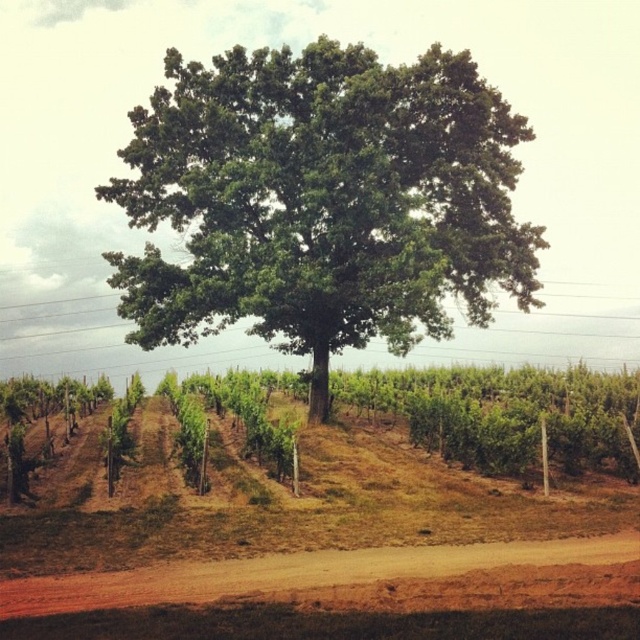
Between green leafy oak at center and brown dirt track at lower center, which one appears on the left side from the viewer's perspective?

From the viewer's perspective, green leafy oak at center appears more on the left side.

You are a GUI agent. You are given a task and a screenshot of the screen. Output one action in this format:
    pyautogui.click(x=<x>, y=<y>)
    Task: Click on the green leafy oak at center
    The height and width of the screenshot is (640, 640).
    Given the screenshot: What is the action you would take?
    pyautogui.click(x=323, y=200)